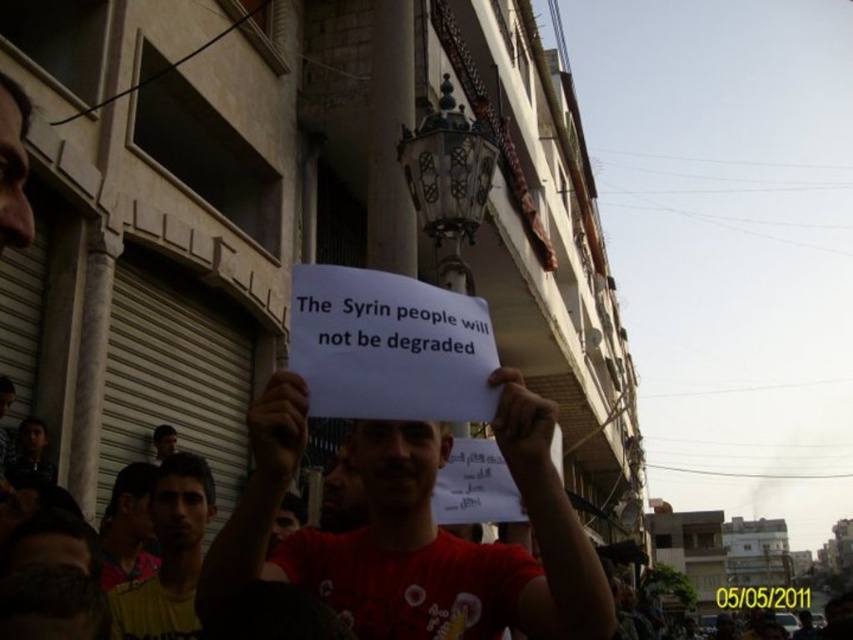
You are a photographer trying to capture a photo of the white paper at center and the yellow printed shirt at lower left in the same frame. The camera you are using has a maximum focus range of 10 meters. Can you ensure both objects are in focus and within the frame?

The white paper at center is 9.77 meters from the yellow printed shirt at lower left. Since the distance between them is within the camera maximum focus range of 10 meters, both objects can be captured in focus and within the frame.

You are a photographer trying to capture the protest scene. You notice the white paper at center and the yellow printed shirt at lower left. Which object should you focus on to ensure it appears larger in your photo?

The white paper at center should be focused on because it is larger than the yellow printed shirt at lower left, making it more prominent in the frame.